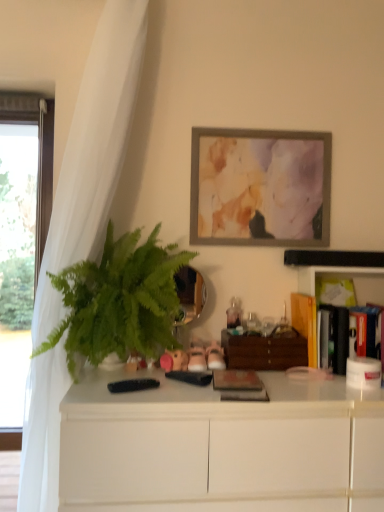
Question: Is green leafy plant at left thinner than rustic wooden book at center, arranged as the 1th book when viewed from the front?

Choices:
 (A) no
 (B) yes

Answer: (A)

Question: Is green leafy plant at left placed right next to rustic wooden book at center, which appears as the 1th book when viewed from the left?

Choices:
 (A) yes
 (B) no

Answer: (B)

Question: Would you say green leafy plant at left is outside rustic wooden book at center, which appears as the 1th book when viewed from the left?

Choices:
 (A) no
 (B) yes

Answer: (B)

Question: Considering the relative sizes of green leafy plant at left and rustic wooden book at center, which appears as the 1th book when viewed from the left, in the image provided, is green leafy plant at left shorter than rustic wooden book at center, which appears as the 1th book when viewed from the left,?

Choices:
 (A) no
 (B) yes

Answer: (A)

Question: From a real-world perspective, does green leafy plant at left sit lower than rustic wooden book at center, which ranks as the third book in back-to-front order?

Choices:
 (A) yes
 (B) no

Answer: (B)

Question: Is rustic wooden book at center, which ranks as the third book in back-to-front order, in front of or behind pink fabric stuffed animal at center in the image?

Choices:
 (A) behind
 (B) front

Answer: (B)

Question: Choose the correct answer: Is rustic wooden book at center, acting as the third book starting from the right, inside pink fabric stuffed animal at center or outside it?

Choices:
 (A) inside
 (B) outside

Answer: (B)

Question: Does point (235, 399) appear closer or farther from the camera than point (165, 365)?

Choices:
 (A) closer
 (B) farther

Answer: (A)

Question: Would you say rustic wooden book at center, which ranks as the third book in back-to-front order, is to the left or to the right of pink fabric stuffed animal at center in the picture?

Choices:
 (A) left
 (B) right

Answer: (B)

Question: In terms of height, does white sheer curtain at left look taller or shorter compared to pink fabric stuffed animal at center?

Choices:
 (A) short
 (B) tall

Answer: (B)

Question: Looking at the image, does white sheer curtain at left seem bigger or smaller compared to pink fabric stuffed animal at center?

Choices:
 (A) small
 (B) big

Answer: (B)

Question: From the image's perspective, relative to pink fabric stuffed animal at center, is white sheer curtain at left above or below?

Choices:
 (A) below
 (B) above

Answer: (B)

Question: In terms of width, does white sheer curtain at left look wider or thinner when compared to pink fabric stuffed animal at center?

Choices:
 (A) thin
 (B) wide

Answer: (B)

Question: Is pink fabric stuffed animal at center wider or thinner than green leafy plant at left?

Choices:
 (A) wide
 (B) thin

Answer: (B)

Question: Visually, is pink fabric stuffed animal at center positioned to the left or to the right of green leafy plant at left?

Choices:
 (A) right
 (B) left

Answer: (A)